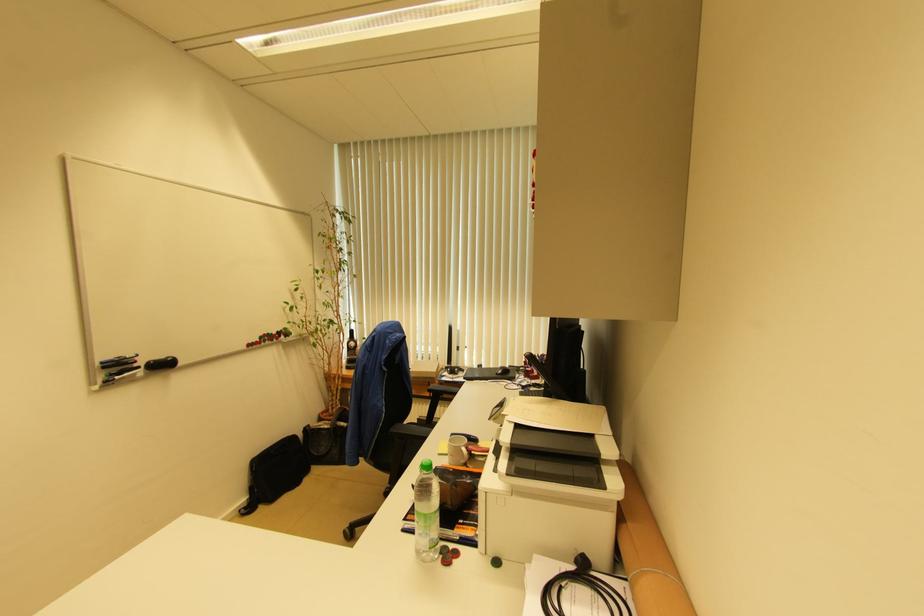
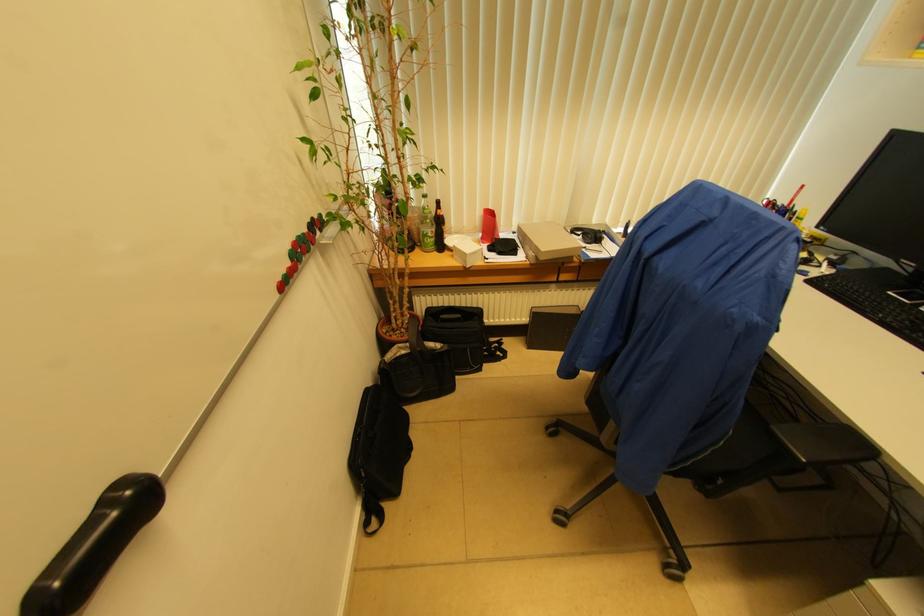
Where in the second image is the point corresponding to (298,487) from the first image?

(409, 451)